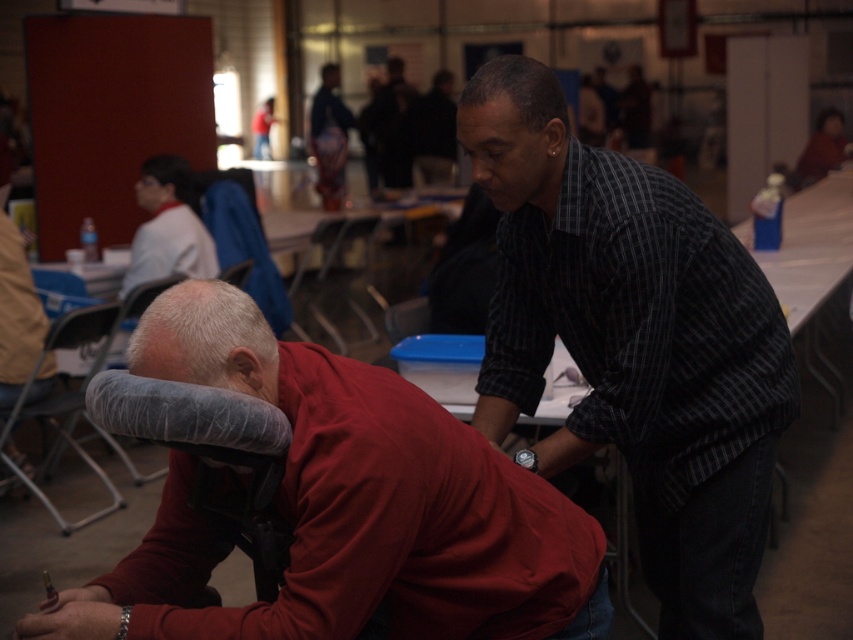
Question: Which object is farther from the camera taking this photo?

Choices:
 (A) gray fabric headrest at lower center
 (B) metallic gray chair at center
 (C) light gray fabric chair at upper left

Answer: (B)

Question: Which of the following is the farthest from the observer?

Choices:
 (A) (207, 620)
 (B) (206, 253)
 (C) (143, 209)
 (D) (4, 432)

Answer: (C)

Question: Where is gray fabric folding chair at lower left located in relation to metallic gray chair at center in the image?

Choices:
 (A) above
 (B) below

Answer: (B)

Question: Which point is farther to the camera?

Choices:
 (A) matte black hair at upper left
 (B) matte black shirt at center
 (C) black checkered shirt at center
 (D) metallic gray chair at center

Answer: (D)

Question: In this image, where is black checkered shirt at center located relative to matte black shirt at center?

Choices:
 (A) below
 (B) above

Answer: (A)

Question: Is black checkered shirt at center positioned behind matte red shirt at center?

Choices:
 (A) no
 (B) yes

Answer: (B)